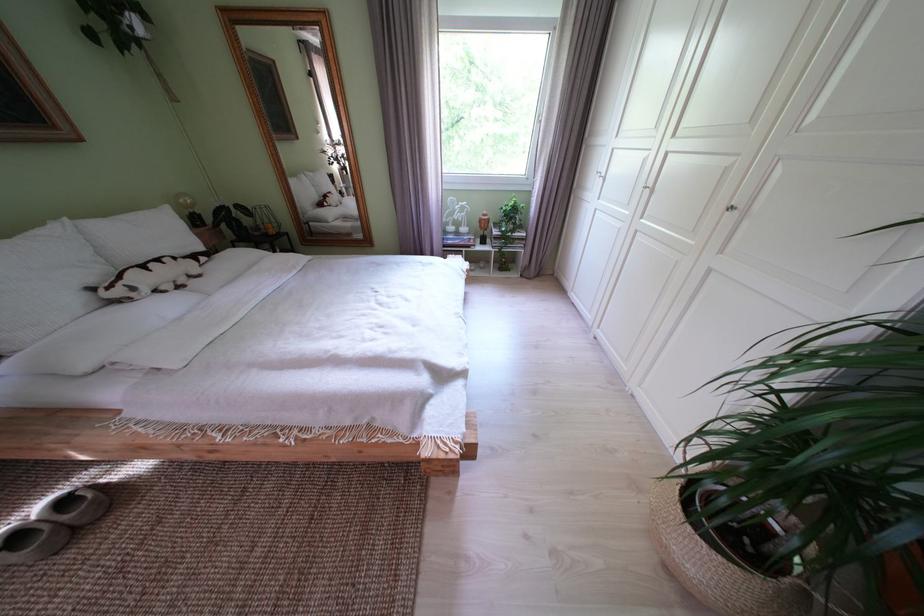
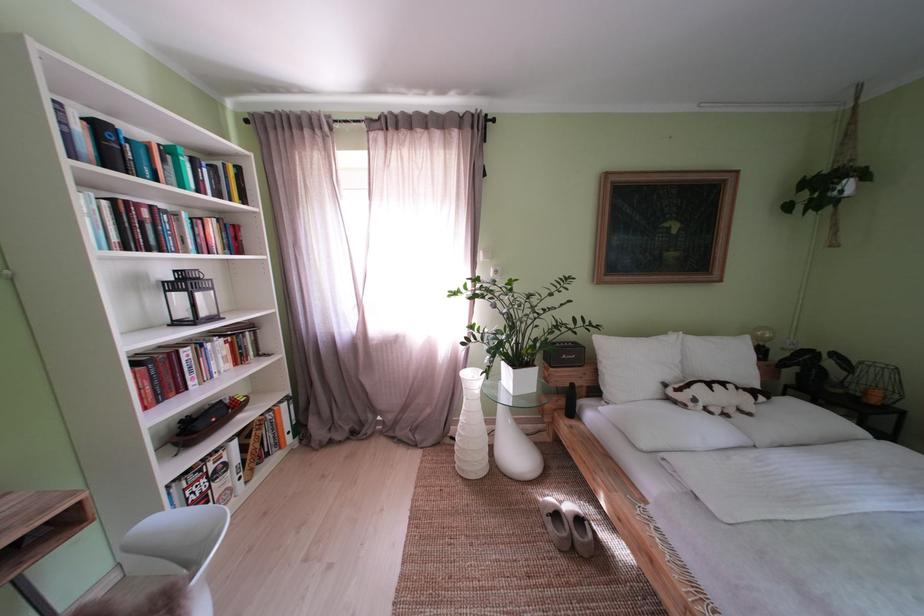
Locate, in the second image, the point that corresponds to point (54, 230) in the first image.

(675, 338)